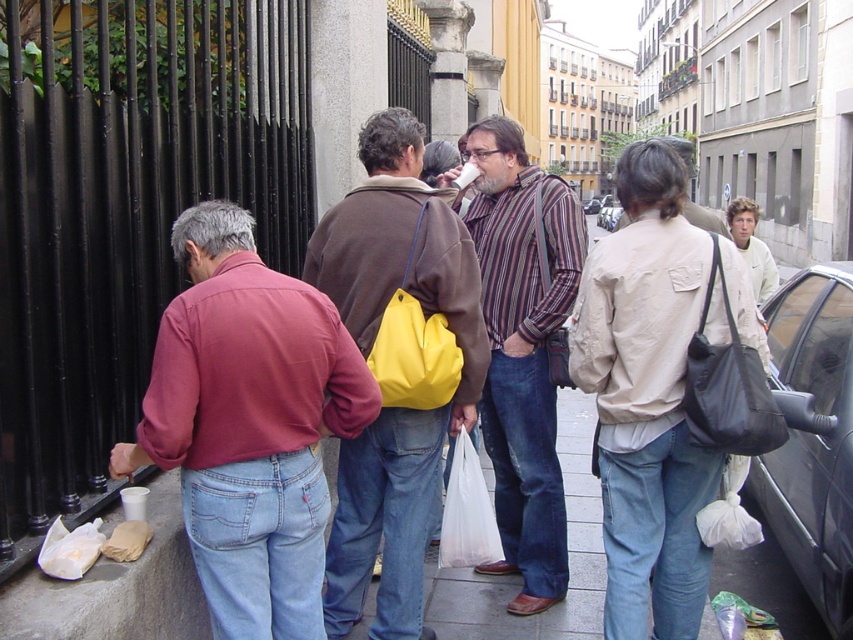
You are a photographer trying to capture a photo of the matte red shirt at left and the metallic silver car at center. Based on their sizes in the image, which one should you focus on first to ensure both are in frame without moving the camera?

The matte red shirt at left occupies less space than the metallic silver car at center, so you should focus on the metallic silver car at center first since it takes up more space and will require more attention to fit properly in the frame.

You are a photographer trying to capture a photo of the brown leather jacket at center and the white plastic bag at lower center. Which object should you focus on first if you want to include both in your frame without moving the camera?

Since the brown leather jacket at center is taller than the white plastic bag at lower center, you should focus on the brown leather jacket at center first to ensure its full height is captured within the frame.

You are a delivery person trying to place a large package on the sidewalk. The package is as tall as the black leather bag at right. Can you safely place it next to the black glossy car at right without it touching the car?

The black glossy car at right is taller than the black leather bag at right. Since the package is as tall as the black leather bag at right, placing it next to the car would leave enough vertical space between them, so yes, it can be safely placed without touching the car.